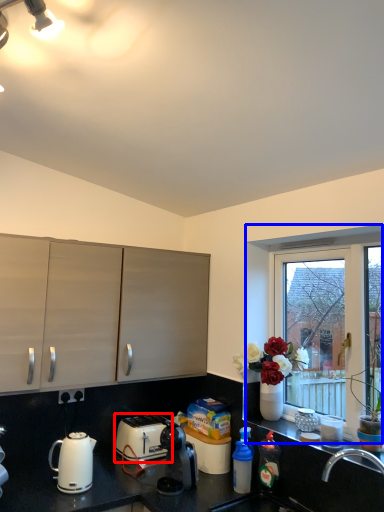
Question: Among these objects, which one is nearest to the camera, toaster (highlighted by a red box) or window (highlighted by a blue box)?

Choices:
 (A) toaster
 (B) window

Answer: (B)